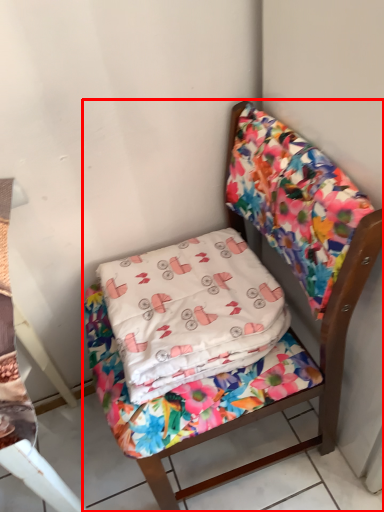
Question: In this image, where is chair (annotated by the red box) located relative to pillow?

Choices:
 (A) right
 (B) left

Answer: (A)